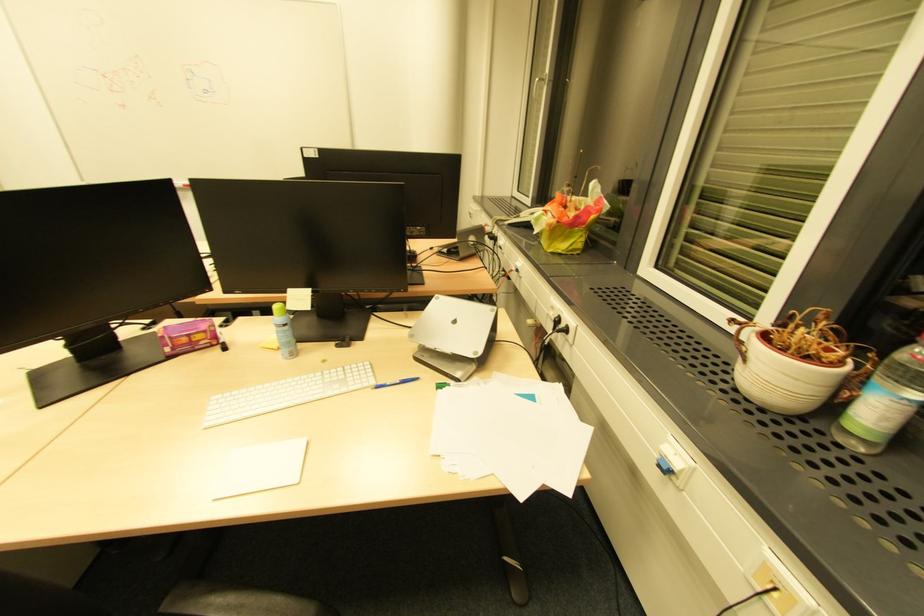
Find where to turn the white window handle. Please return your answer as a coordinate pair (x, y).

(536, 86)